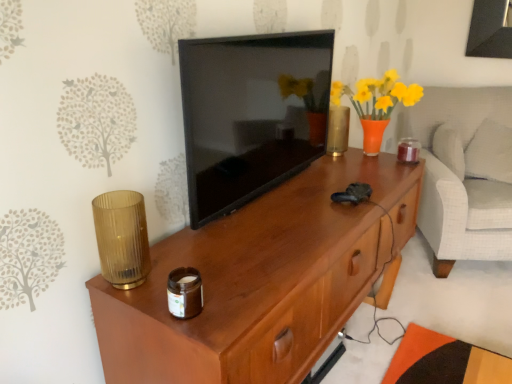
Question: Does wooden desk at center turn towards brown glass jar at lower center, the third candle holder from the top?

Choices:
 (A) yes
 (B) no

Answer: (B)

Question: Is the position of wooden desk at center less distant than that of brown glass jar at lower center, the second candle holder when ordered from left to right?

Choices:
 (A) yes
 (B) no

Answer: (A)

Question: From a real-world perspective, is wooden desk at center located higher than brown glass jar at lower center, which is counted as the 1th candle holder, starting from the bottom?

Choices:
 (A) no
 (B) yes

Answer: (A)

Question: Is wooden desk at center wider than brown glass jar at lower center, which is counted as the 1th candle holder, starting from the bottom?

Choices:
 (A) no
 (B) yes

Answer: (B)

Question: Does wooden desk at center lie behind brown glass jar at lower center, which is the 1th candle holder from front to back?

Choices:
 (A) yes
 (B) no

Answer: (B)

Question: Is brown glass jar at lower center, the 3th candle holder positioned from the back, at the back of wooden desk at center?

Choices:
 (A) no
 (B) yes

Answer: (A)

Question: Does amber ribbed glass at left, which ranks as the first candle holder in left-to-right order, contain wooden desk at center?

Choices:
 (A) yes
 (B) no

Answer: (B)

Question: Considering the relative sizes of amber ribbed glass at left, acting as the 2th candle holder starting from the top, and wooden desk at center in the image provided, is amber ribbed glass at left, acting as the 2th candle holder starting from the top, bigger than wooden desk at center?

Choices:
 (A) no
 (B) yes

Answer: (A)

Question: Considering the relative sizes of amber ribbed glass at left, which ranks as the 2th candle holder in back-to-front order, and wooden desk at center in the image provided, is amber ribbed glass at left, which ranks as the 2th candle holder in back-to-front order, thinner than wooden desk at center?

Choices:
 (A) no
 (B) yes

Answer: (B)

Question: Considering the relative positions of amber ribbed glass at left, acting as the 2th candle holder starting from the bottom, and wooden desk at center in the image provided, is amber ribbed glass at left, acting as the 2th candle holder starting from the bottom, to the right of wooden desk at center from the viewer's perspective?

Choices:
 (A) no
 (B) yes

Answer: (A)

Question: From the image's perspective, does amber ribbed glass at left, which ranks as the first candle holder in left-to-right order, appear lower than wooden desk at center?

Choices:
 (A) no
 (B) yes

Answer: (A)

Question: Is amber ribbed glass at left, which ranks as the 2th candle holder in back-to-front order, looking in the opposite direction of wooden desk at center?

Choices:
 (A) no
 (B) yes

Answer: (A)

Question: Is black glossy tv at center positioned before white soft pillow at right?

Choices:
 (A) yes
 (B) no

Answer: (A)